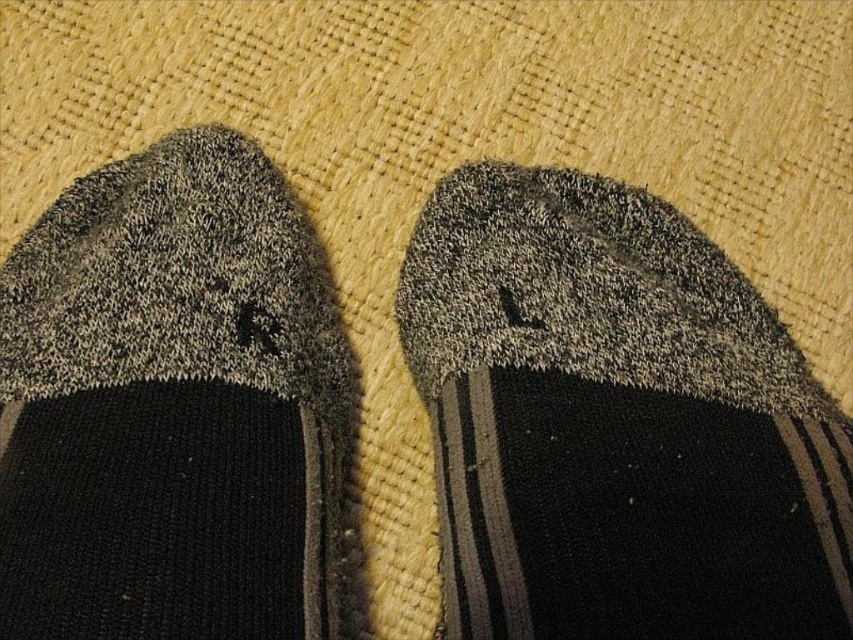
Question: Does textured gray sock at center appear over knit fabric sock at left?

Choices:
 (A) no
 (B) yes

Answer: (A)

Question: Is textured gray sock at center closer to camera compared to knit fabric sock at left?

Choices:
 (A) yes
 (B) no

Answer: (B)

Question: Where is textured gray sock at center located in relation to knit fabric sock at left in the image?

Choices:
 (A) left
 (B) right

Answer: (B)

Question: Which object appears farthest from the camera in this image?

Choices:
 (A) knit fabric sock at left
 (B) textured gray sock at center

Answer: (B)